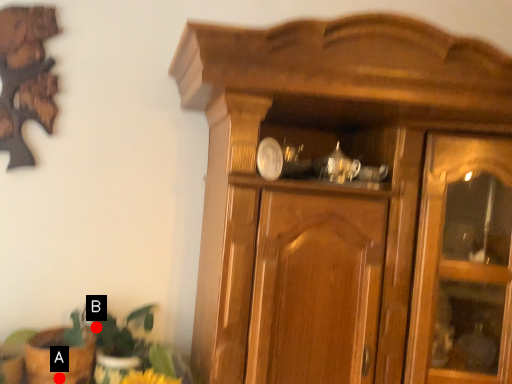
Question: Two points are circled on the image, labeled by A and B beside each circle. Which point is closer to the camera taking this photo?

Choices:
 (A) A is closer
 (B) B is closer

Answer: (A)